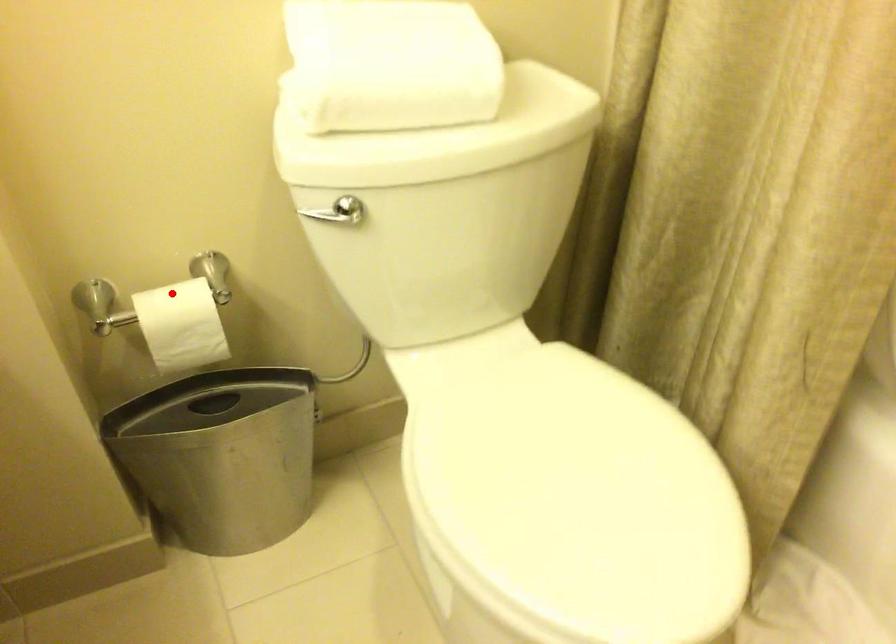
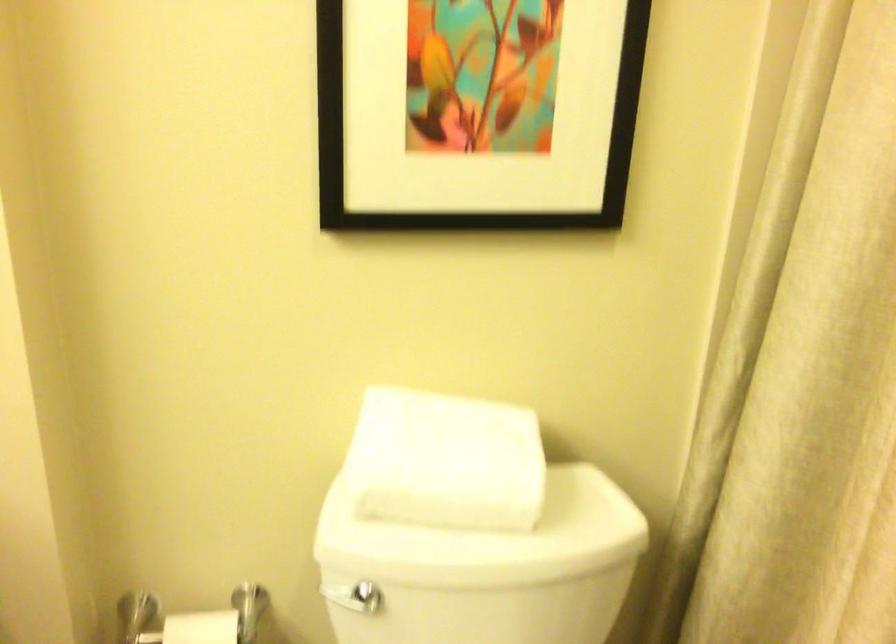
Find the pixel in the second image that matches the highlighted location in the first image.

(201, 627)